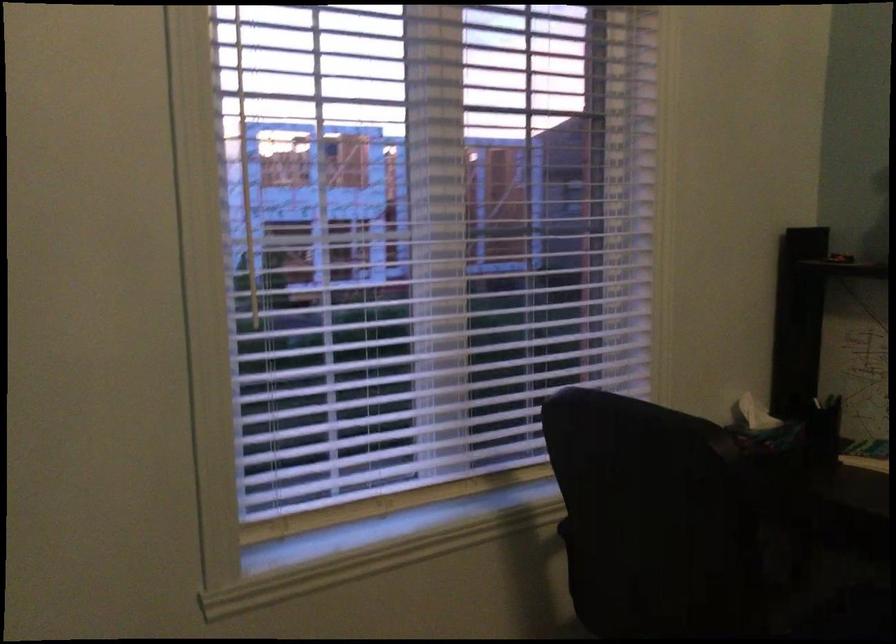
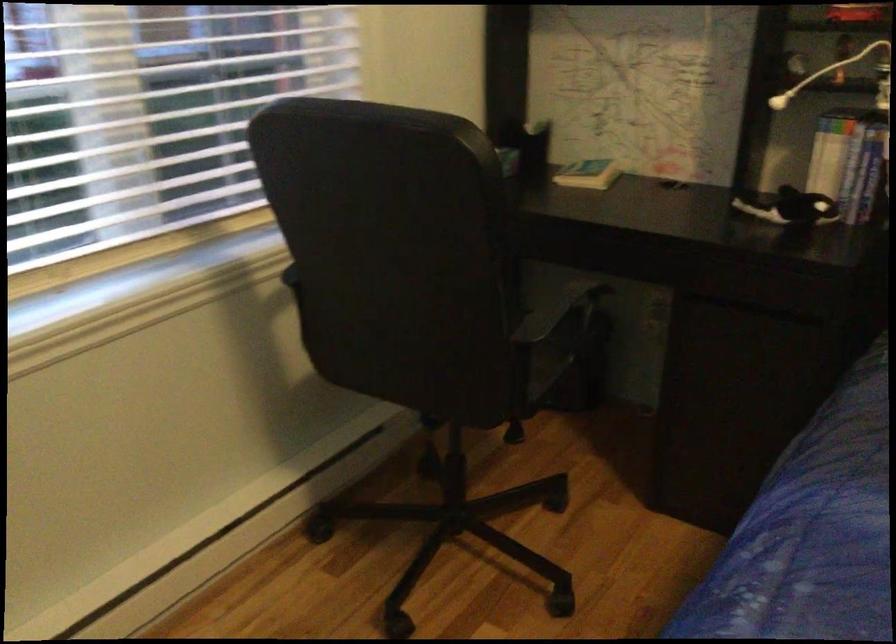
Question: Which direction would the cameraman need to move to produce the second image? Reply with the corresponding letter.

Choices:
 (A) Left
 (B) Right
 (C) Forward
 (D) Backward

Answer: (C)